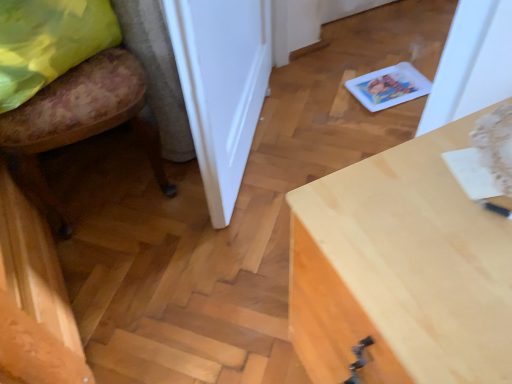
Question: Considering the relative sizes of light wood desk at center and yellow fabric pillow at left in the image provided, is light wood desk at center taller than yellow fabric pillow at left?

Choices:
 (A) yes
 (B) no

Answer: (A)

Question: From the image's perspective, is light wood desk at center below yellow fabric pillow at left?

Choices:
 (A) no
 (B) yes

Answer: (B)

Question: Is light wood desk at center beside yellow fabric pillow at left?

Choices:
 (A) no
 (B) yes

Answer: (A)

Question: Is the depth of light wood desk at center greater than that of yellow fabric pillow at left?

Choices:
 (A) yes
 (B) no

Answer: (B)

Question: Does light wood desk at center appear on the right side of yellow fabric pillow at left?

Choices:
 (A) yes
 (B) no

Answer: (A)

Question: Could you tell me if light wood desk at center is turned towards yellow fabric pillow at left?

Choices:
 (A) no
 (B) yes

Answer: (A)

Question: Is white glossy door at center shorter than floral fabric chair at lower left?

Choices:
 (A) no
 (B) yes

Answer: (A)

Question: Is white glossy door at center to the right of floral fabric chair at lower left from the viewer's perspective?

Choices:
 (A) no
 (B) yes

Answer: (B)

Question: Is white glossy door at center touching floral fabric chair at lower left?

Choices:
 (A) no
 (B) yes

Answer: (A)

Question: Is white glossy door at center wider than floral fabric chair at lower left?

Choices:
 (A) no
 (B) yes

Answer: (A)

Question: Is white glossy door at center aimed at floral fabric chair at lower left?

Choices:
 (A) no
 (B) yes

Answer: (A)

Question: Can you confirm if white glossy door at center is thinner than floral fabric chair at lower left?

Choices:
 (A) no
 (B) yes

Answer: (B)

Question: Is light wood desk at center at the left side of floral fabric chair at lower left?

Choices:
 (A) yes
 (B) no

Answer: (B)